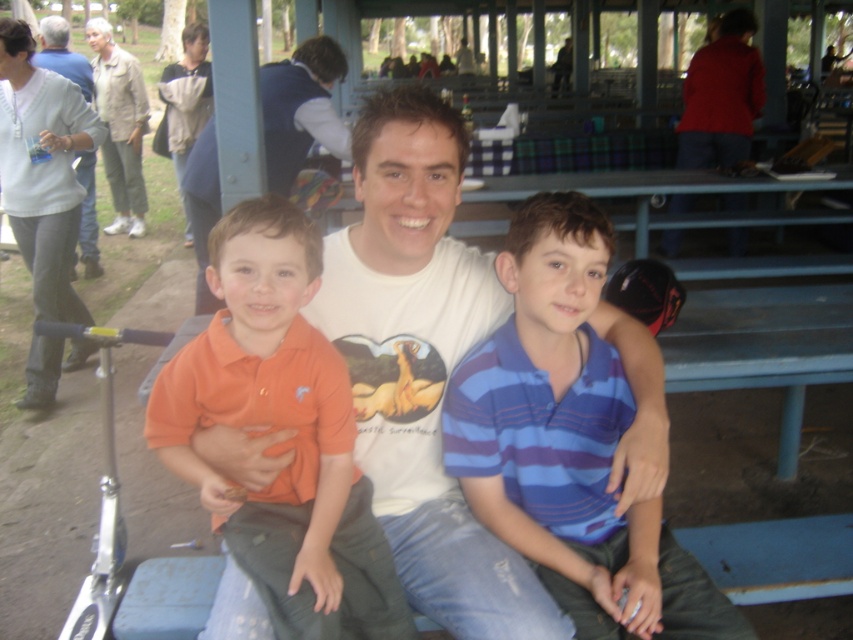
Question: Based on their relative distances, which object is nearer to the light gray sweater at upper left?

Choices:
 (A) blue striped shirt at center
 (B) beige fabric jacket at upper left

Answer: (B)

Question: Can you confirm if beige fabric jacket at upper left is positioned to the right of light gray sweater at upper left?

Choices:
 (A) no
 (B) yes

Answer: (B)

Question: Is blue striped shirt at center positioned in front of light gray sweater at upper left?

Choices:
 (A) no
 (B) yes

Answer: (B)

Question: Considering the real-world distances, which object is closest to the orange cotton shirt at center?

Choices:
 (A) beige fabric jacket at upper left
 (B) blue striped shirt at center

Answer: (B)

Question: Estimate the real-world distances between objects in this image. Which object is closer to the beige fabric jacket at upper left?

Choices:
 (A) orange cotton shirt at center
 (B) light gray sweater at upper left

Answer: (B)

Question: Is blue striped shirt at center below light gray sweater at upper left?

Choices:
 (A) yes
 (B) no

Answer: (A)